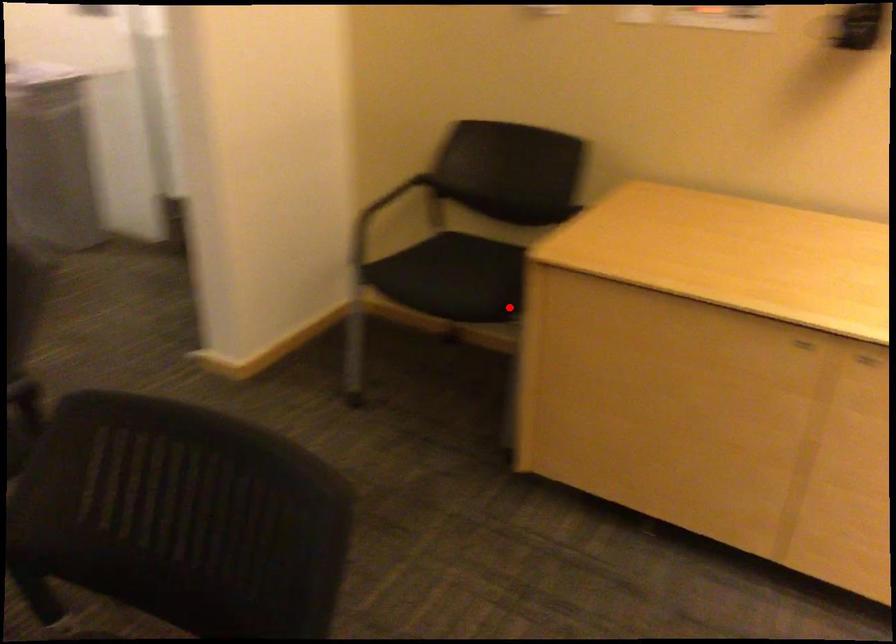
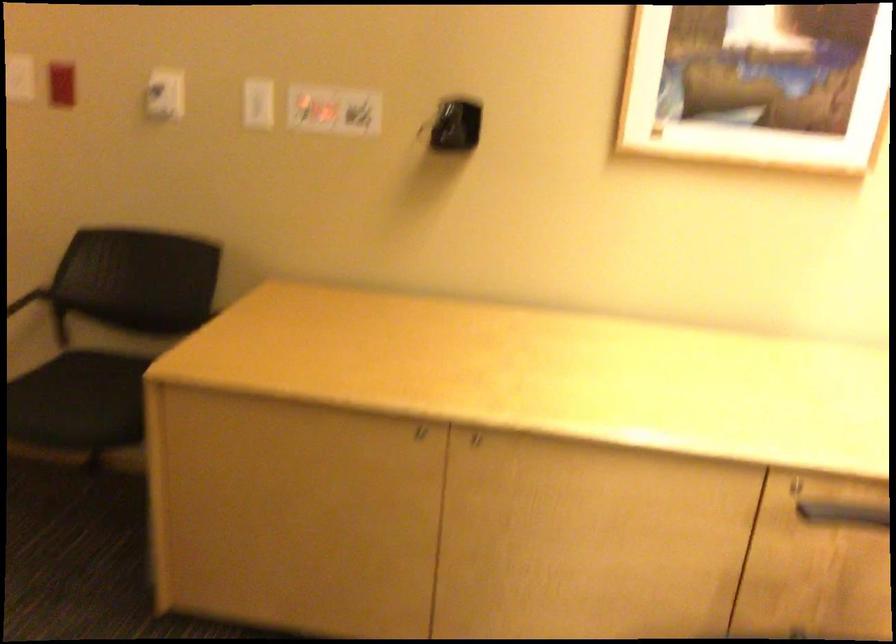
Where in the second image is the point corresponding to the highlighted location from the first image?

(143, 440)